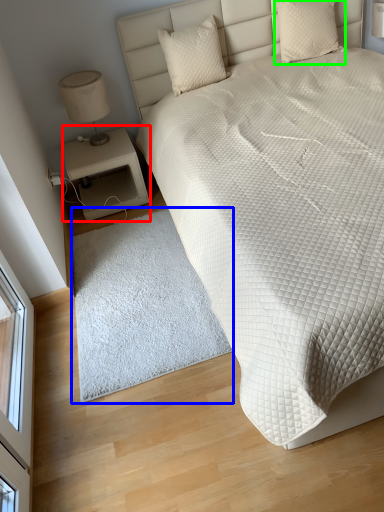
Question: Considering the real-world distances, which object is farthest from nightstand (highlighted by a red box)? mat (highlighted by a blue box) or pillow (highlighted by a green box)?

Choices:
 (A) mat
 (B) pillow

Answer: (B)